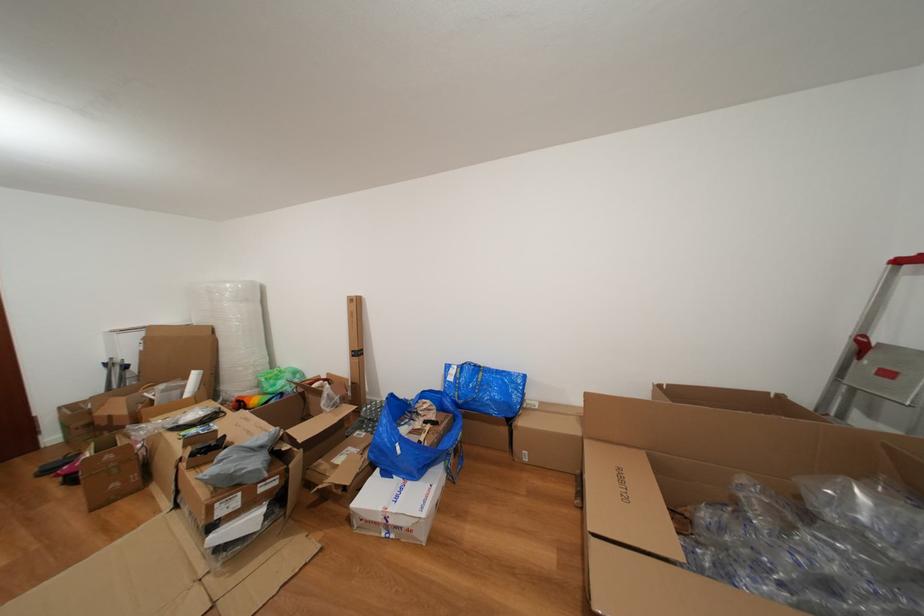
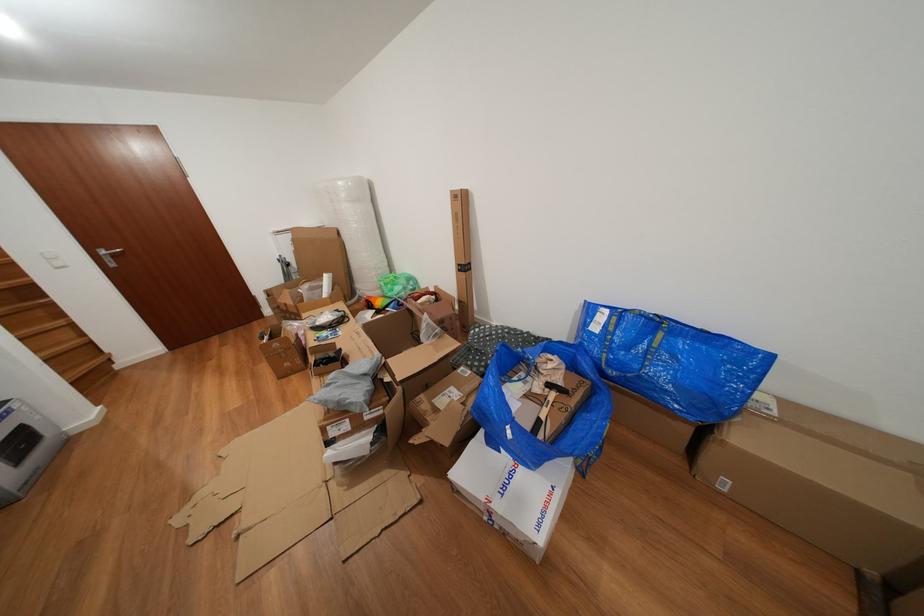
In the second image, find the point that corresponds to point (406, 503) in the first image.

(513, 493)